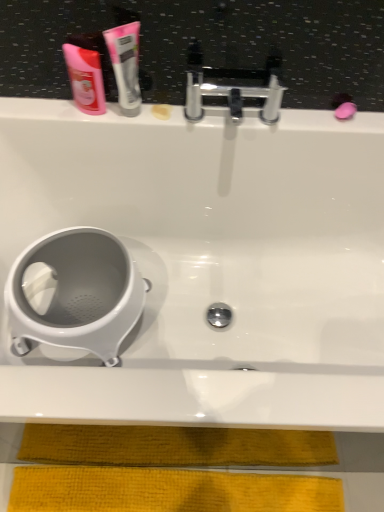
Question: Does white glossy tube at upper center lie in front of polished chrome faucet at upper center?

Choices:
 (A) no
 (B) yes

Answer: (B)

Question: Is white glossy tube at upper center outside of polished chrome faucet at upper center?

Choices:
 (A) no
 (B) yes

Answer: (B)

Question: Is white glossy tube at upper center taller than polished chrome faucet at upper center?

Choices:
 (A) no
 (B) yes

Answer: (B)

Question: Is white glossy tube at upper center at the left side of polished chrome faucet at upper center?

Choices:
 (A) no
 (B) yes

Answer: (B)

Question: From the image's perspective, does white glossy tube at upper center appear higher than polished chrome faucet at upper center?

Choices:
 (A) yes
 (B) no

Answer: (A)

Question: Is white glossy tube at upper center further to camera compared to polished chrome faucet at upper center?

Choices:
 (A) yes
 (B) no

Answer: (B)

Question: Is the surface of pink glossy mouthwash at upper left in direct contact with white plastic toilet at lower left?

Choices:
 (A) yes
 (B) no

Answer: (B)

Question: Is pink glossy mouthwash at upper left shorter than white plastic toilet at lower left?

Choices:
 (A) no
 (B) yes

Answer: (B)

Question: Is there a large distance between pink glossy mouthwash at upper left and white plastic toilet at lower left?

Choices:
 (A) no
 (B) yes

Answer: (A)

Question: Is pink glossy mouthwash at upper left facing away from white plastic toilet at lower left?

Choices:
 (A) no
 (B) yes

Answer: (A)

Question: From the image's perspective, is pink glossy mouthwash at upper left located above white plastic toilet at lower left?

Choices:
 (A) yes
 (B) no

Answer: (A)

Question: Can you confirm if pink glossy mouthwash at upper left is smaller than white plastic toilet at lower left?

Choices:
 (A) no
 (B) yes

Answer: (B)

Question: Is white glossy tube at upper center completely or partially inside white plastic toilet at lower left?

Choices:
 (A) no
 (B) yes

Answer: (A)